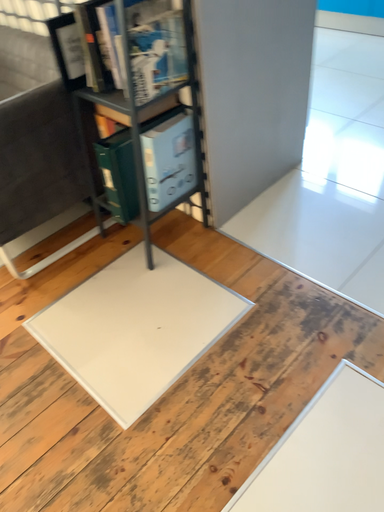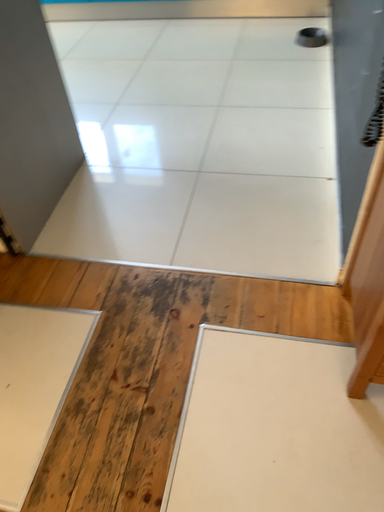
Question: How did the camera likely rotate when shooting the video?

Choices:
 (A) rotated left
 (B) rotated right

Answer: (B)